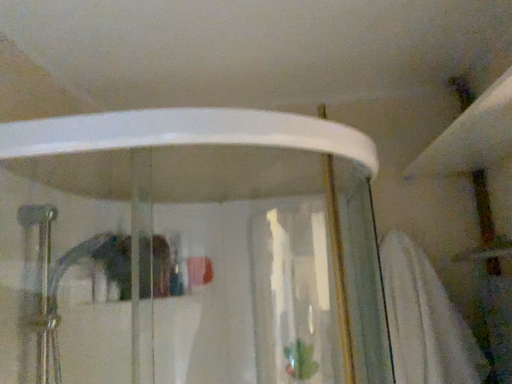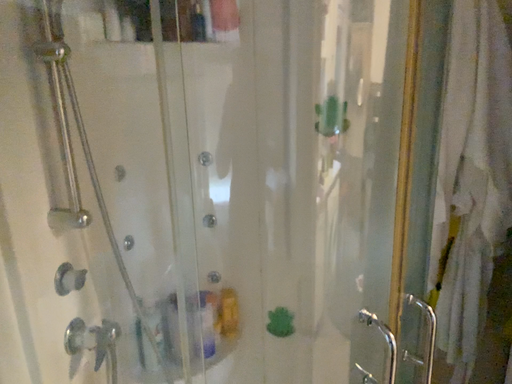
Question: How did the camera likely rotate when shooting the video?

Choices:
 (A) rotated downward
 (B) rotated upward

Answer: (A)